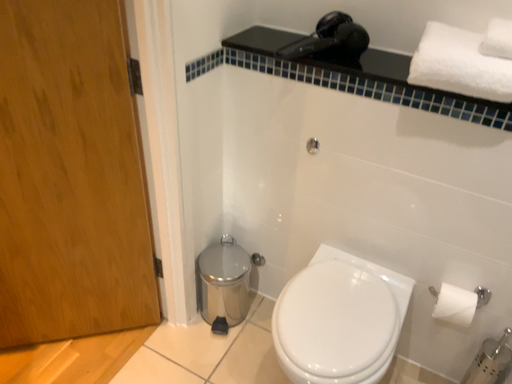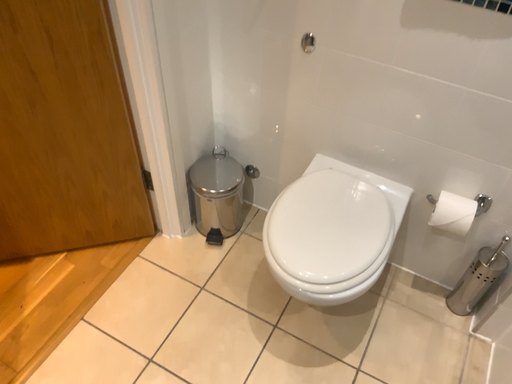
Question: Which way did the camera rotate in the video?

Choices:
 (A) rotated downward
 (B) rotated upward

Answer: (A)